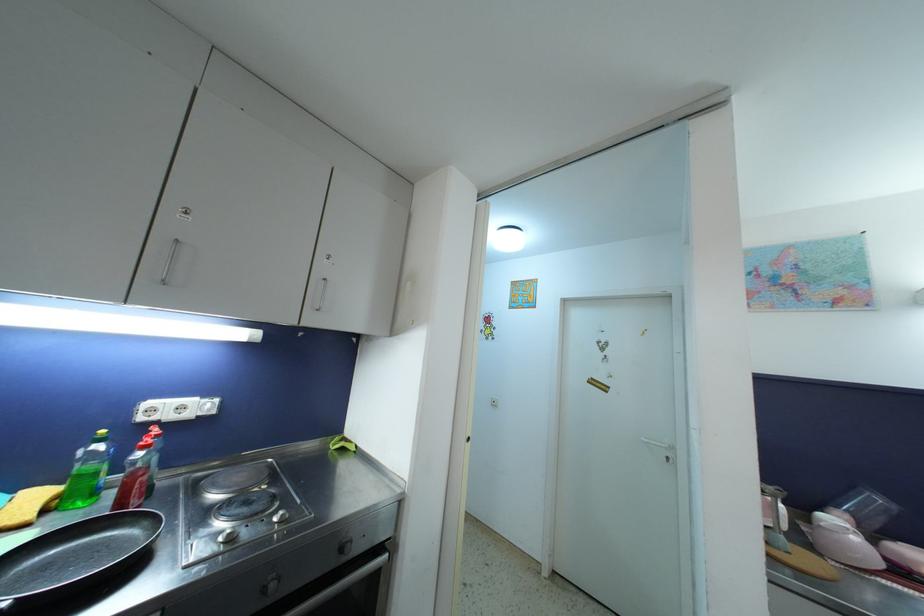
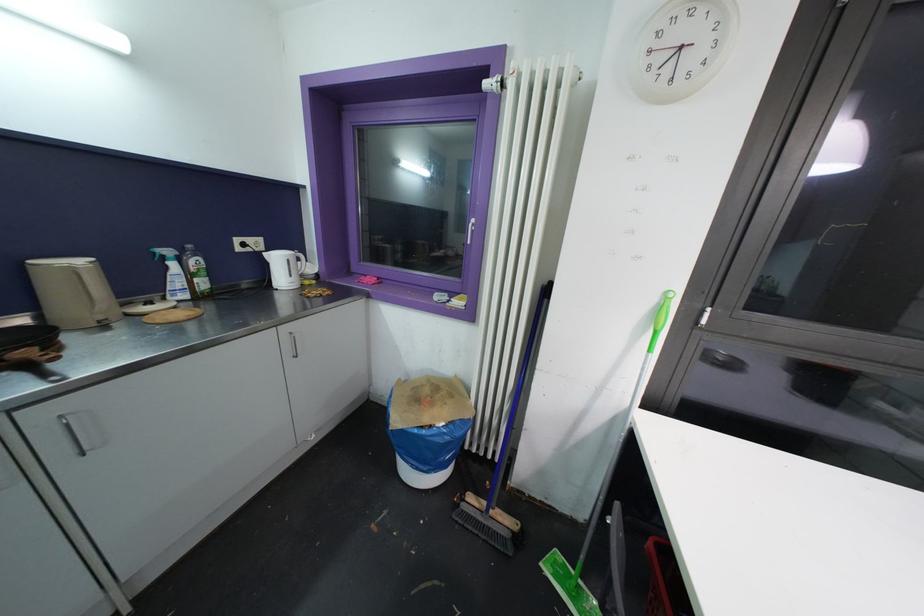
The images are taken continuously from a first-person perspective. In which direction is your viewpoint rotating?

The camera rotated toward right-down.